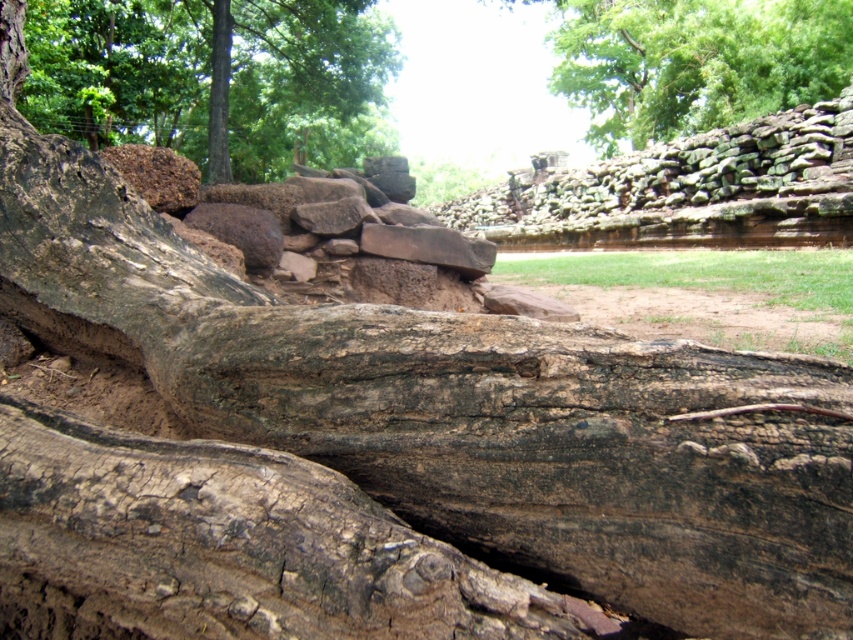
Question: Which object is the farthest from the brown rough tree trunk at upper left?

Choices:
 (A) rustic stone wall at upper center
 (B) green leafy tree at upper center

Answer: (B)

Question: Which object is the closest to the brown rough tree trunk at upper left?

Choices:
 (A) rustic stone wall at upper center
 (B) green leafy tree at upper center

Answer: (A)

Question: Is brown rough tree trunk at upper left below green leafy tree at upper center?

Choices:
 (A) no
 (B) yes

Answer: (B)

Question: Is brown rough tree trunk at upper left to the left of green leafy tree at upper center from the viewer's perspective?

Choices:
 (A) yes
 (B) no

Answer: (A)

Question: Which object appears farthest from the camera in this image?

Choices:
 (A) rustic stone wall at upper center
 (B) brown rough tree trunk at upper left
 (C) green leafy tree at upper center

Answer: (C)

Question: Does brown rough tree trunk at upper left have a greater width compared to rustic stone wall at upper center?

Choices:
 (A) yes
 (B) no

Answer: (A)